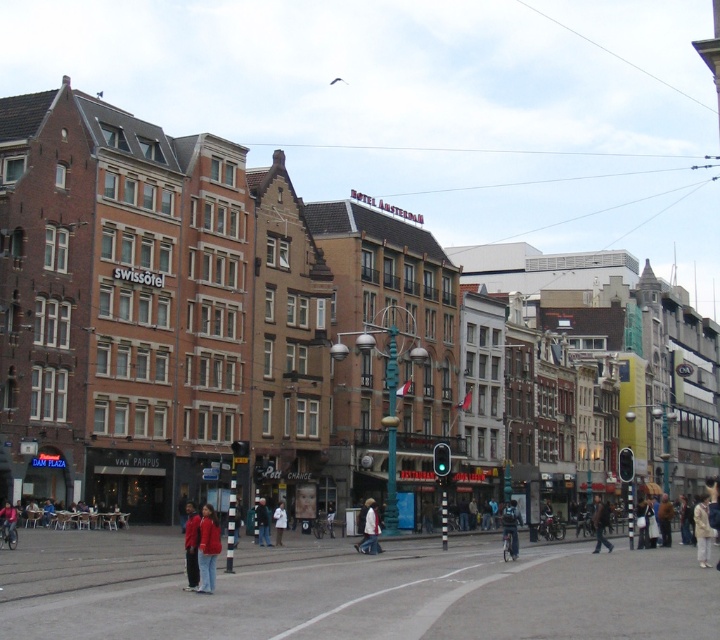
Question: Which point is closer to the camera taking this photo?

Choices:
 (A) (513, 544)
 (B) (256, 524)
 (C) (192, 541)

Answer: (C)

Question: Does red jacket at lower center have a larger size compared to white cotton jacket at center?

Choices:
 (A) yes
 (B) no

Answer: (A)

Question: Which object is positioned farthest from the red jacket at lower center?

Choices:
 (A) dark blue jeans at lower center
 (B) white cotton jacket at center

Answer: (A)

Question: Estimate the real-world distances between objects in this image. Which object is closer to the dark blue jeans at lower center?

Choices:
 (A) red fabric jacket at lower left
 (B) dark brown leather jacket at center
 (C) white matte jacket at center

Answer: (C)

Question: Does red jacket at lower center appear over dark blue jacket at center?

Choices:
 (A) yes
 (B) no

Answer: (A)

Question: Does red fabric jacket at lower left lie behind dark blue jacket at center?

Choices:
 (A) no
 (B) yes

Answer: (A)